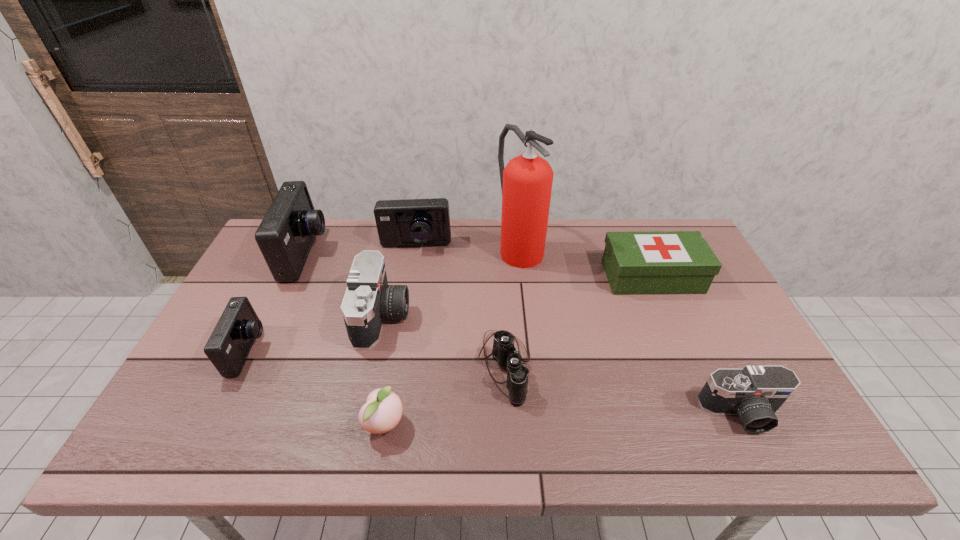
Identify the location of fire extinguisher. (526, 182).

At what (x,y) coordinates should I click in order to perform the action: click on red fire extinguisher. Please return your answer as a coordinate pair (x, y). This screenshot has height=540, width=960. Looking at the image, I should click on (526, 182).

Find the location of a particular element. the biggest blue camera is located at coordinates (285, 236).

Identify the location of the second tallest object. (285, 236).

Find the location of a particular element. The height and width of the screenshot is (540, 960). the second smallest blue camera is located at coordinates (412, 222).

The image size is (960, 540). In order to click on the farther black camera in this screenshot , I will do `click(368, 300)`.

The image size is (960, 540). I want to click on the bigger black camera, so click(x=368, y=300).

This screenshot has width=960, height=540. I want to click on the nearest blue camera, so click(x=228, y=347).

You are a GUI agent. You are given a task and a screenshot of the screen. Output one action in this format:
    pyautogui.click(x=<x>, y=<y>)
    Task: Click on the first-aid kit
    
    Given the screenshot: What is the action you would take?
    pyautogui.click(x=657, y=262)

Identify the location of binoculars. (504, 352).